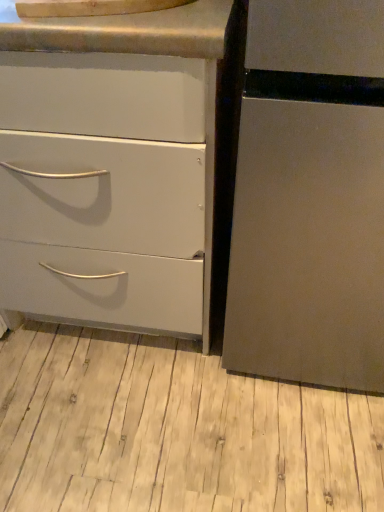
Question: Is matte white drawer at left facing away from light wood floor at lower center?

Choices:
 (A) no
 (B) yes

Answer: (A)

Question: Are matte white drawer at left and light wood floor at lower center making contact?

Choices:
 (A) yes
 (B) no

Answer: (B)

Question: Does matte white drawer at left have a smaller size compared to light wood floor at lower center?

Choices:
 (A) no
 (B) yes

Answer: (A)

Question: Could you tell me if matte white drawer at left is facing light wood floor at lower center?

Choices:
 (A) yes
 (B) no

Answer: (B)

Question: From a real-world perspective, is matte white drawer at left on light wood floor at lower center?

Choices:
 (A) yes
 (B) no

Answer: (A)

Question: Does matte white drawer at left have a larger size compared to light wood floor at lower center?

Choices:
 (A) no
 (B) yes

Answer: (B)

Question: Can you confirm if light wood floor at lower center is wider than matte white drawer at left?

Choices:
 (A) no
 (B) yes

Answer: (B)

Question: From a real-world perspective, is light wood floor at lower center physically below matte white drawer at left?

Choices:
 (A) yes
 (B) no

Answer: (A)

Question: Is light wood floor at lower center not within matte white drawer at left?

Choices:
 (A) no
 (B) yes

Answer: (B)

Question: From the image's perspective, is light wood floor at lower center on matte white drawer at left?

Choices:
 (A) yes
 (B) no

Answer: (B)

Question: Is light wood floor at lower center closer to camera compared to matte white drawer at left?

Choices:
 (A) yes
 (B) no

Answer: (B)

Question: Could you tell me if light wood floor at lower center is facing matte white drawer at left?

Choices:
 (A) no
 (B) yes

Answer: (A)

Question: Can you confirm if matte white drawer at left is positioned to the left of brushed metal counter top at upper center?

Choices:
 (A) no
 (B) yes

Answer: (B)